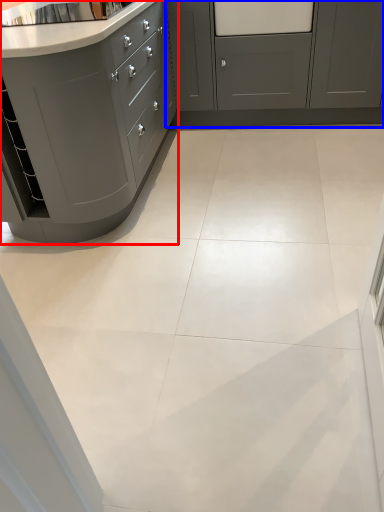
Question: Which object is further to the camera taking this photo, cabinetry (highlighted by a red box) or cabinetry (highlighted by a blue box)?

Choices:
 (A) cabinetry
 (B) cabinetry

Answer: (B)